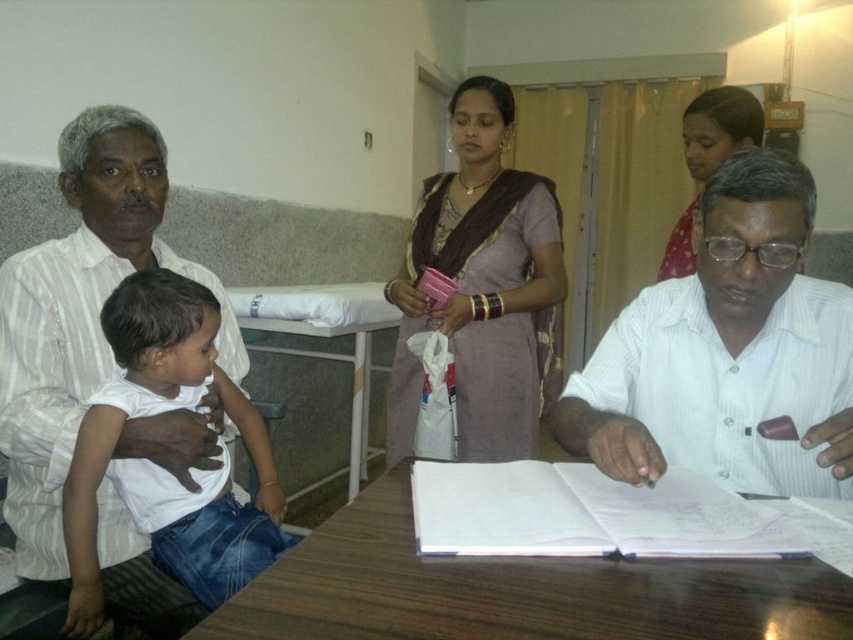
In order to click on white striped shirt at center in this screenshot , I will do `click(727, 352)`.

Is point (700, 300) positioned after point (729, 88)?

No, (700, 300) is in front of (729, 88).

I want to click on white striped shirt at center, so click(x=727, y=352).

Where is `white striped shirt at center`? white striped shirt at center is located at coordinates (727, 352).

Who is more forward, (666, 307) or (701, 563)?

Positioned in front is point (701, 563).

Measure the distance between white striped shirt at center and camera.

A distance of 87.23 centimeters exists between white striped shirt at center and camera.

You are a GUI agent. You are given a task and a screenshot of the screen. Output one action in this format:
    pyautogui.click(x=<x>, y=<y>)
    Task: Click on the white striped shirt at center
    This screenshot has width=853, height=640.
    Given the screenshot: What is the action you would take?
    pyautogui.click(x=727, y=352)

Which is behind, point (643, 368) or point (378, 324)?

The point (378, 324) is behind.

This screenshot has height=640, width=853. What do you see at coordinates (727, 352) in the screenshot? I see `white striped shirt at center` at bounding box center [727, 352].

What do you see at coordinates (727, 352) in the screenshot?
I see `white striped shirt at center` at bounding box center [727, 352].

The image size is (853, 640). I want to click on white striped shirt at center, so click(x=727, y=352).